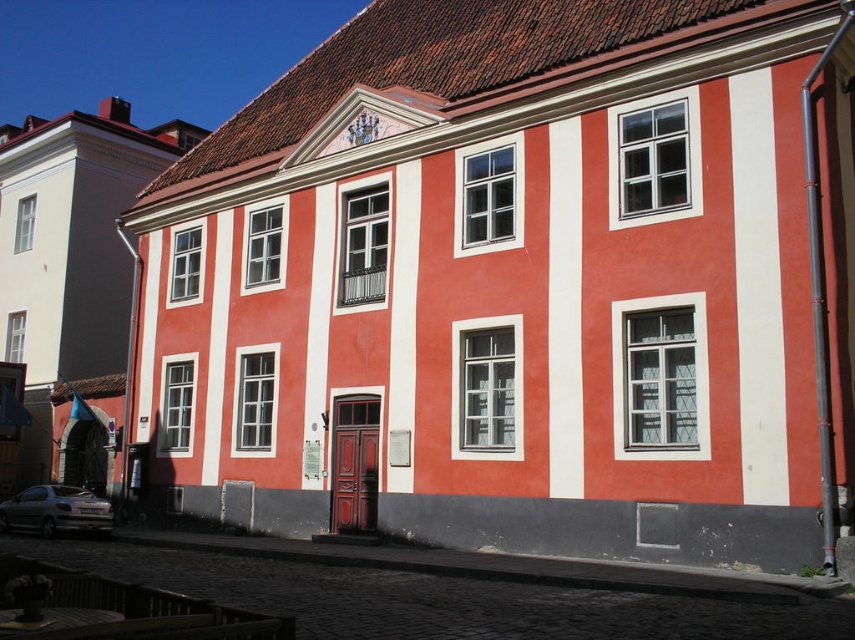
Question: Does red matte stripe at center appear over matte silver car at lower left?

Choices:
 (A) no
 (B) yes

Answer: (B)

Question: Which object is closer to the camera taking this photo?

Choices:
 (A) matte silver car at lower left
 (B) red matte stripe at center
 (C) white matte stripe at right

Answer: (C)

Question: Which of the following is the farthest from the observer?

Choices:
 (A) (16, 506)
 (B) (771, 500)
 (C) (563, 218)

Answer: (A)

Question: Can you confirm if white matte stripe at right is positioned to the left of matte silver car at lower left?

Choices:
 (A) no
 (B) yes

Answer: (A)

Question: In this image, where is red matte stripe at center located relative to matte silver car at lower left?

Choices:
 (A) above
 (B) below

Answer: (A)

Question: Which of these objects is positioned farthest from the matte silver car at lower left?

Choices:
 (A) red matte stripe at center
 (B) white matte stripe at right

Answer: (B)